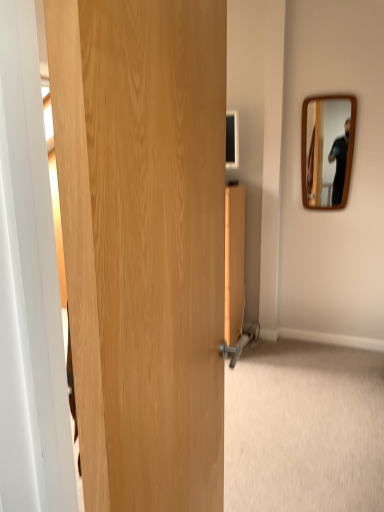
Question: Looking at the image, does natural wood door at center seem bigger or smaller compared to wooden mirror at upper right?

Choices:
 (A) big
 (B) small

Answer: (A)

Question: Considering their positions, is natural wood door at center located in front of or behind wooden mirror at upper right?

Choices:
 (A) behind
 (B) front

Answer: (B)

Question: Choose the correct answer: Is natural wood door at center inside wooden mirror at upper right or outside it?

Choices:
 (A) inside
 (B) outside

Answer: (B)

Question: Is point (349, 153) closer or farther from the camera than point (79, 411)?

Choices:
 (A) farther
 (B) closer

Answer: (A)

Question: In the image, is wooden mirror at upper right on the left side or the right side of natural wood door at center?

Choices:
 (A) left
 (B) right

Answer: (B)

Question: From their relative heights in the image, would you say wooden mirror at upper right is taller or shorter than natural wood door at center?

Choices:
 (A) short
 (B) tall

Answer: (A)

Question: Do you think wooden mirror at upper right is within natural wood door at center, or outside of it?

Choices:
 (A) inside
 (B) outside

Answer: (B)